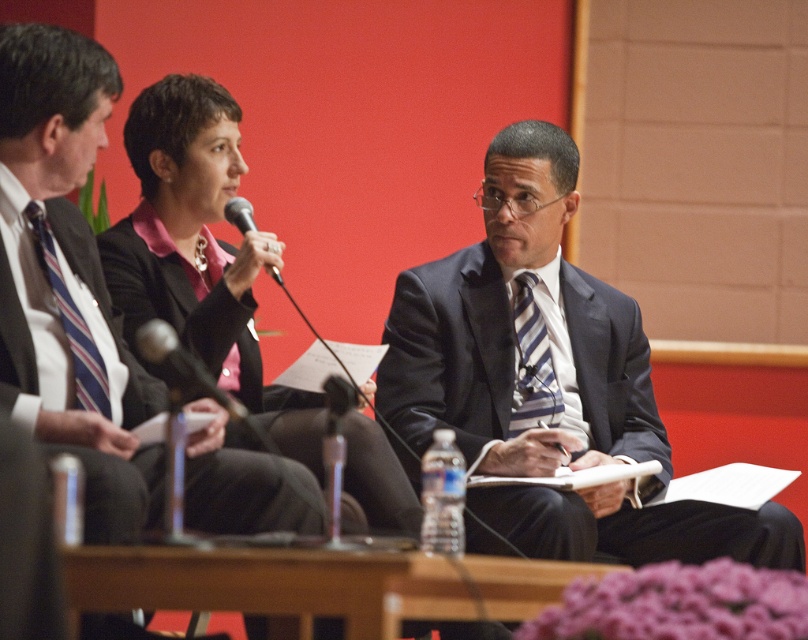
Question: Which point is closer to the camera?

Choices:
 (A) (112, 406)
 (B) (152, 340)

Answer: (A)

Question: Which of these objects is positioned farthest from the black metallic microphone at center?

Choices:
 (A) black plastic microphone at upper center
 (B) wooden table at center
 (C) dark blue suit at center

Answer: (C)

Question: Does dark blue suit at center have a lesser width compared to black metallic microphone at center?

Choices:
 (A) no
 (B) yes

Answer: (A)

Question: Can you confirm if striped fabric tie at center is positioned below black metallic microphone at center?

Choices:
 (A) no
 (B) yes

Answer: (A)

Question: Which object is the farthest from the dark blue textured suit at center?

Choices:
 (A) black metallic microphone at center
 (B) wooden table at center
 (C) striped fabric tie at left
 (D) dark blue suit at center

Answer: (B)

Question: Does striped fabric tie at left have a larger size compared to black metallic microphone at center?

Choices:
 (A) no
 (B) yes

Answer: (A)